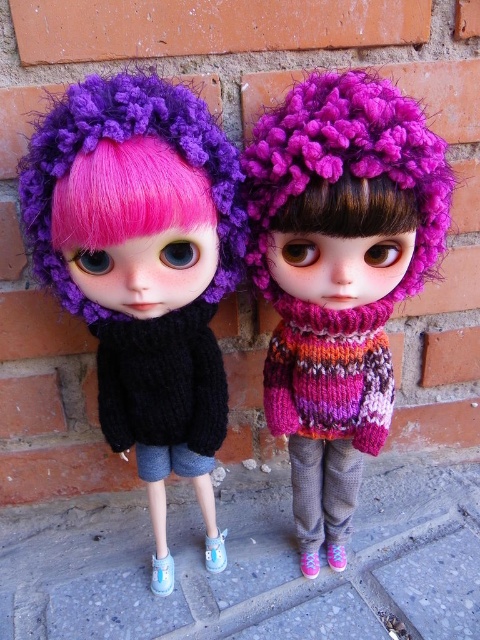
From the picture: Does purple knitted hat at upper center have a greater width compared to fuzzy pink hair at center?

Yes, purple knitted hat at upper center is wider than fuzzy pink hair at center.

Does point (428, 177) come behind point (349, 211)?

Yes, it is behind point (349, 211).

You are a GUI agent. You are given a task and a screenshot of the screen. Output one action in this format:
    pyautogui.click(x=<x>, y=<y>)
    Task: Click on the purple knitted hat at upper center
    This screenshot has width=480, height=640.
    Given the screenshot: What is the action you would take?
    pyautogui.click(x=347, y=161)

Who is positioned more to the left, matte black sweater at left or purple knitted hat at left?

Positioned to the left is purple knitted hat at left.

What do you see at coordinates (144, 269) in the screenshot? The width and height of the screenshot is (480, 640). I see `matte black sweater at left` at bounding box center [144, 269].

Locate an element on the screen. matte black sweater at left is located at coordinates (144, 269).

Which of these two, fuzzy pink knit hat at center or knitted multicolor sweater at center, stands taller?

fuzzy pink knit hat at center

Can you confirm if fuzzy pink knit hat at center is shorter than knitted multicolor sweater at center?

In fact, fuzzy pink knit hat at center may be taller than knitted multicolor sweater at center.

Who is more distant from viewer, (304, 307) or (319, 420)?

Positioned behind is point (319, 420).

Where is `fuzzy pink knit hat at center`? This screenshot has width=480, height=640. fuzzy pink knit hat at center is located at coordinates click(x=338, y=275).